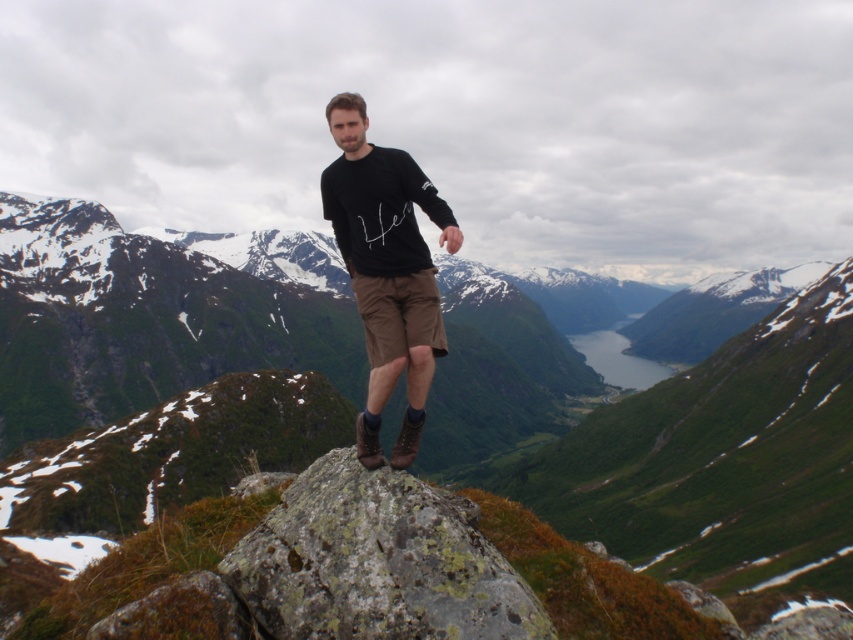
You are a hiker trying to navigate through the valley below. You notice two landmarks marked as point coordinates on your map. The first is at point (53, 221) and the second is at point (294, 516). According to the image, which point is closer to your current position on the rocky outcrop?

Point (294, 516) is closer to your current position on the rocky outcrop because point (53, 221) is behind it.

You are a photographer trying to capture the rugged stone mountain at center and the black cotton shirt at center in a single frame. Which object will appear larger in the photo?

The rugged stone mountain at center will appear larger in the photo because it is larger in size than the black cotton shirt at center.

You are a photographer aiming to capture the rugged stone mountain at center and the black cotton shirt at center in a single frame. Based on their positions, which object should you adjust your camera to focus on first to ensure both are in the frame?

The rugged stone mountain at center is to the right of the black cotton shirt at center. To ensure both are in the frame, focus on the black cotton shirt at center first, then adjust the camera to include the rugged stone mountain at center to the right.